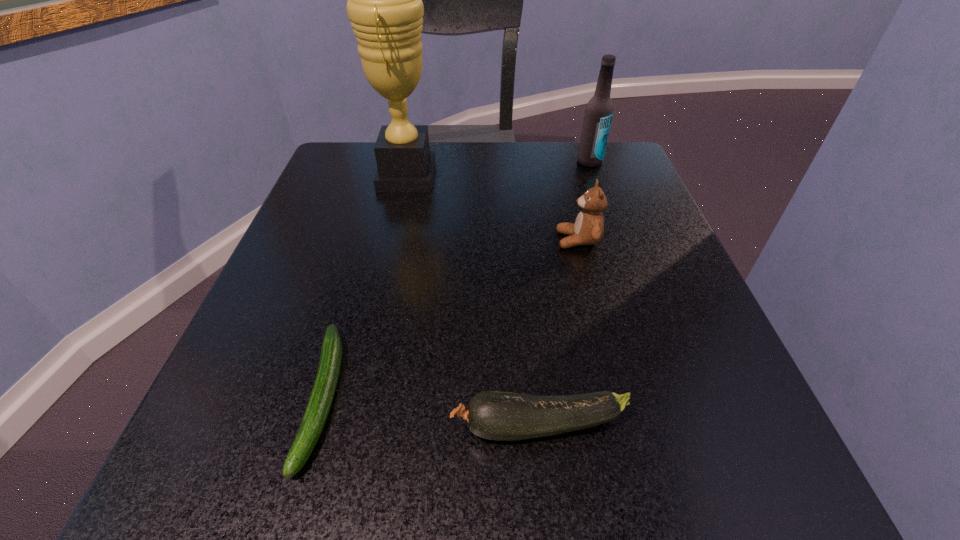
I want to click on trophy cup, so click(x=385, y=7).

Locate an element on the screen. beer bottle is located at coordinates (599, 110).

At what (x,y) coordinates should I click in order to perform the action: click on the fourth shortest object. Please return your answer as a coordinate pair (x, y). The height and width of the screenshot is (540, 960). Looking at the image, I should click on (599, 110).

The height and width of the screenshot is (540, 960). In order to click on the third nearest object in this screenshot , I will do `click(588, 229)`.

Identify the location of the third shortest object. The width and height of the screenshot is (960, 540). (588, 229).

Locate an element on the screen. This screenshot has height=540, width=960. the taller zucchini is located at coordinates (501, 416).

Identify the location of the fourth tallest object. (501, 416).

Locate an element on the screen. the shortest object is located at coordinates (321, 398).

I want to click on the shorter zucchini, so click(321, 398).

Where is `free spot located at the front of the trophy cup with handles`? Image resolution: width=960 pixels, height=540 pixels. free spot located at the front of the trophy cup with handles is located at coordinates (588, 176).